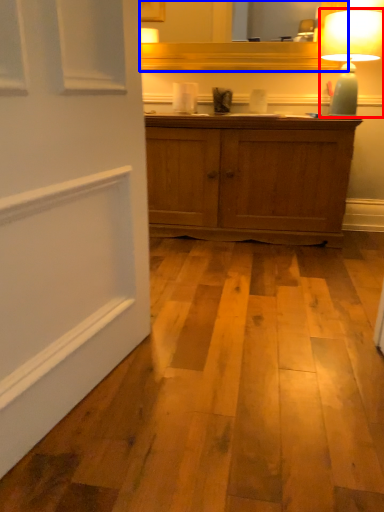
Question: Among these objects, which one is nearest to the camera, table lamp (highlighted by a red box) or mirror (highlighted by a blue box)?

Choices:
 (A) table lamp
 (B) mirror

Answer: (A)